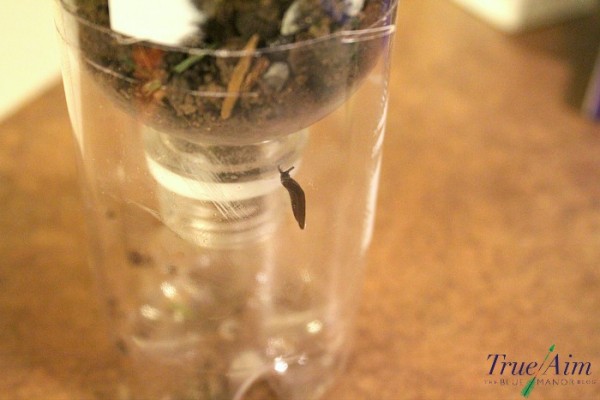
What are the coordinates of `blurred yellowish white back wall` in the screenshot? It's located at (21, 48), (503, 9), (542, 9).